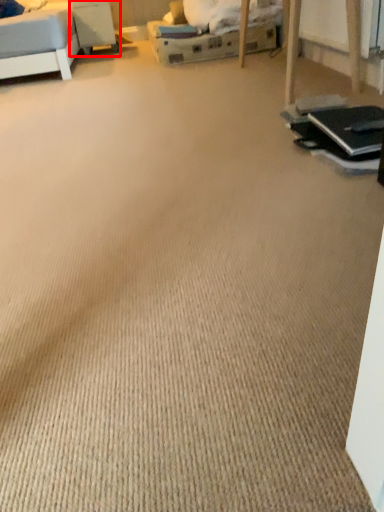
Question: From the image's perspective, what is the correct spatial relationship of table (annotated by the red box) in relation to laptop?

Choices:
 (A) above
 (B) below

Answer: (A)